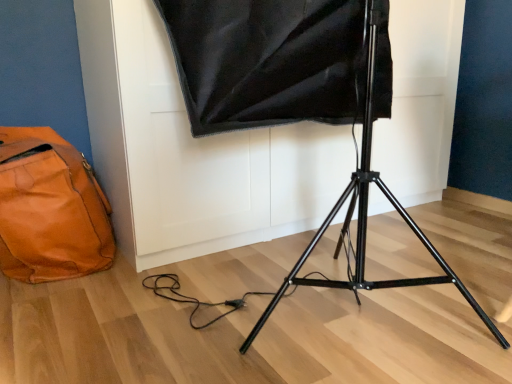
You are a GUI agent. You are given a task and a screenshot of the screen. Output one action in this format:
    pyautogui.click(x=<x>, y=<y>)
    Task: Click on the black matte tripod at center
    The image size is (512, 384).
    Given the screenshot: What is the action you would take?
    pyautogui.click(x=367, y=215)

This screenshot has width=512, height=384. What do you see at coordinates (367, 215) in the screenshot?
I see `black matte tripod at center` at bounding box center [367, 215].

Find the location of a particular element. Image resolution: width=512 pixels, height=384 pixels. orange leather bag at lower left is located at coordinates (50, 209).

The width and height of the screenshot is (512, 384). What do you see at coordinates (50, 209) in the screenshot? I see `orange leather bag at lower left` at bounding box center [50, 209].

What is the approximate height of orange leather bag at lower left?

17.22 inches.

At what (x,y) coordinates should I click in order to perform the action: click on black matte tripod at center. Please return your answer as a coordinate pair (x, y). Looking at the image, I should click on (x=367, y=215).

Visually, is black matte tripod at center positioned to the left or to the right of orange leather bag at lower left?

Clearly, black matte tripod at center is on the right of orange leather bag at lower left in the image.

Between black matte tripod at center and orange leather bag at lower left, which one is positioned in front?

black matte tripod at center is more forward.

Is point (417, 229) positioned after point (102, 264)?

Yes, it is behind point (102, 264).

From the image's perspective, who appears lower, black matte tripod at center or orange leather bag at lower left?

orange leather bag at lower left.

From a real-world perspective, is black matte tripod at center located higher than orange leather bag at lower left?

Indeed, from a real-world perspective, black matte tripod at center stands above orange leather bag at lower left.

Between black matte tripod at center and orange leather bag at lower left, which one has larger width?

With larger width is black matte tripod at center.

Between black matte tripod at center and orange leather bag at lower left, which one has more height?

With more height is black matte tripod at center.

Which of these two, black matte tripod at center or orange leather bag at lower left, is bigger?

With larger size is black matte tripod at center.

Is orange leather bag at lower left located within black matte tripod at center?

No, orange leather bag at lower left is not inside black matte tripod at center.

Is black matte tripod at center next to orange leather bag at lower left and touching it?

No.

Is black matte tripod at center facing away from orange leather bag at lower left?

No, black matte tripod at center's orientation is not away from orange leather bag at lower left.

Measure the distance from black matte tripod at center to orange leather bag at lower left.

A distance of 76.62 centimeters exists between black matte tripod at center and orange leather bag at lower left.

At what (x,y) coordinates should I click in order to perform the action: click on bag located underneath the black matte tripod at center (from a real-world perspective). Please return your answer as a coordinate pair (x, y). The height and width of the screenshot is (384, 512). Looking at the image, I should click on (50, 209).

Can you confirm if orange leather bag at lower left is positioned to the right of black matte tripod at center?

In fact, orange leather bag at lower left is to the left of black matte tripod at center.

Considering the positions of objects orange leather bag at lower left and black matte tripod at center in the image provided, who is behind, orange leather bag at lower left or black matte tripod at center?

Positioned behind is orange leather bag at lower left.

Between point (14, 272) and point (371, 133), which one is positioned behind?

The point (14, 272) is more distant.

From the image's perspective, is orange leather bag at lower left above or below black matte tripod at center?

From the image's perspective, orange leather bag at lower left appears below black matte tripod at center.

From a real-world perspective, is orange leather bag at lower left positioned under black matte tripod at center based on gravity?

Yes, from a real-world perspective, orange leather bag at lower left is beneath black matte tripod at center.

Which of these two, orange leather bag at lower left or black matte tripod at center, is thinner?

orange leather bag at lower left is thinner.

Considering the sizes of orange leather bag at lower left and black matte tripod at center in the image, is orange leather bag at lower left taller or shorter than black matte tripod at center?

orange leather bag at lower left is shorter than black matte tripod at center.

Considering the relative sizes of orange leather bag at lower left and black matte tripod at center in the image provided, is orange leather bag at lower left bigger than black matte tripod at center?

No.

Is orange leather bag at lower left not inside black matte tripod at center?

Indeed, orange leather bag at lower left is completely outside black matte tripod at center.

Is orange leather bag at lower left directly adjacent to black matte tripod at center?

No, orange leather bag at lower left is not in contact with black matte tripod at center.

Is orange leather bag at lower left oriented away from black matte tripod at center?

That's not correct — orange leather bag at lower left is not looking away from black matte tripod at center.

What's the angular difference between orange leather bag at lower left and black matte tripod at center's facing directions?

They differ by 3.84 degrees in their facing directions.

Where is `tripod above the orange leather bag at lower left (from the image's perspective)`? Image resolution: width=512 pixels, height=384 pixels. tripod above the orange leather bag at lower left (from the image's perspective) is located at coordinates (367, 215).

The height and width of the screenshot is (384, 512). I want to click on tripod above the orange leather bag at lower left (from the image's perspective), so click(x=367, y=215).

At what (x,y) coordinates should I click in order to perform the action: click on bag on the left of black matte tripod at center. Please return your answer as a coordinate pair (x, y). This screenshot has height=384, width=512. Looking at the image, I should click on (50, 209).